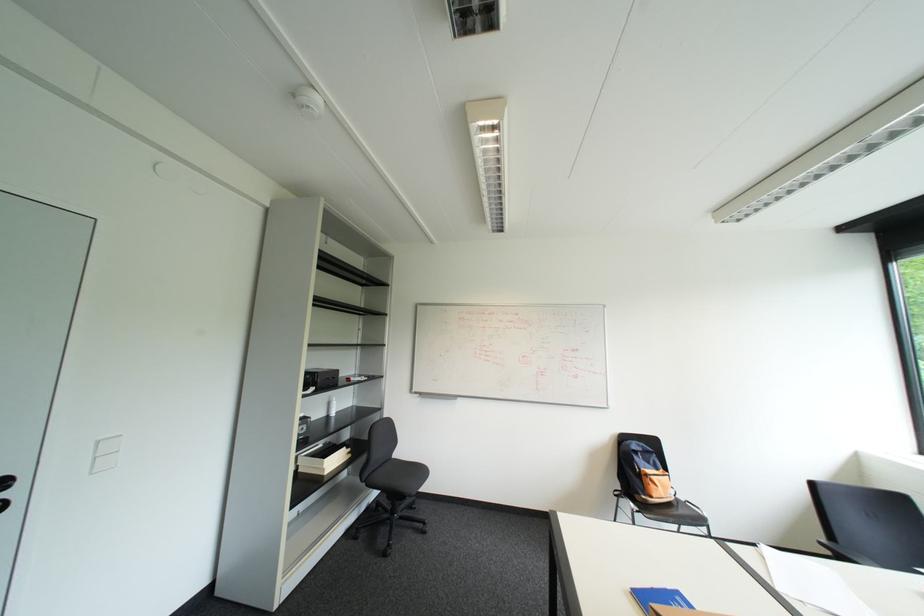
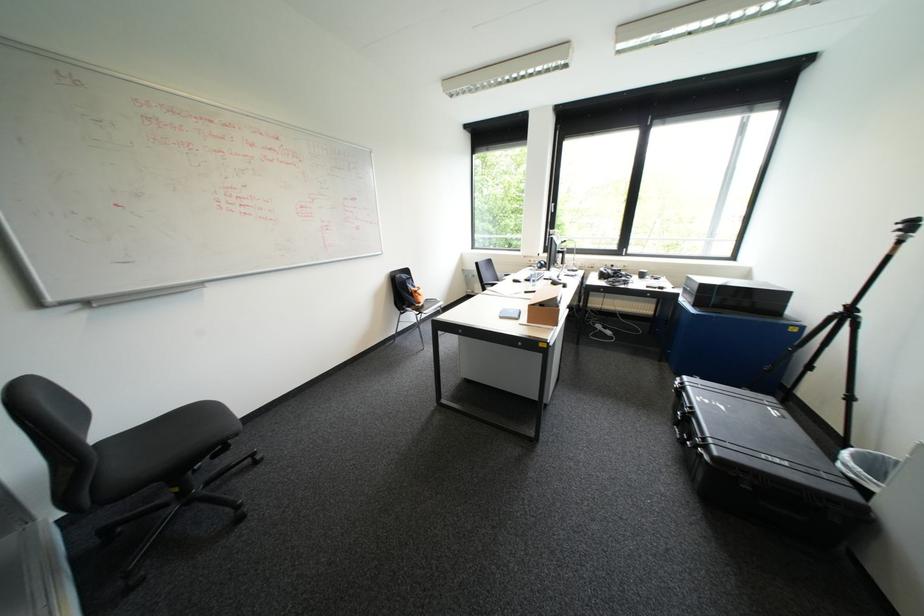
In the second image, find the point that corresponds to the point at 648,467 in the first image.

(419, 288)